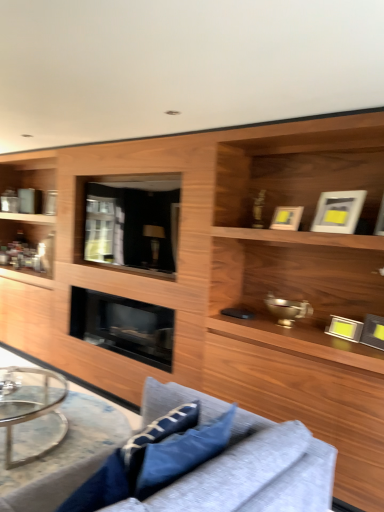
Question: Can you confirm if black glass fireplace at center is thinner than blue fabric pillow at lower center, which ranks as the first pillow in back-to-front order?

Choices:
 (A) yes
 (B) no

Answer: (B)

Question: Can you confirm if black glass fireplace at center is bigger than blue fabric pillow at lower center, acting as the second pillow starting from the left?

Choices:
 (A) yes
 (B) no

Answer: (A)

Question: From the image's perspective, is black glass fireplace at center beneath blue fabric pillow at lower center, acting as the second pillow starting from the left?

Choices:
 (A) no
 (B) yes

Answer: (A)

Question: Is black glass fireplace at center next to blue fabric pillow at lower center, which ranks as the first pillow in back-to-front order, and touching it?

Choices:
 (A) no
 (B) yes

Answer: (A)

Question: Is black glass fireplace at center far away from blue fabric pillow at lower center, the 2th pillow viewed from the front?

Choices:
 (A) no
 (B) yes

Answer: (B)

Question: Considering the positions of clear glass round table at lower left and blue fabric pillow at lower center, the 1th pillow positioned from the left, in the image, is clear glass round table at lower left bigger or smaller than blue fabric pillow at lower center, the 1th pillow positioned from the left,?

Choices:
 (A) big
 (B) small

Answer: (A)

Question: Is clear glass round table at lower left wider or thinner than blue fabric pillow at lower center, the 1th pillow positioned from the left?

Choices:
 (A) wide
 (B) thin

Answer: (A)

Question: Would you say clear glass round table at lower left is to the left or to the right of blue fabric pillow at lower center, which is the second pillow in back-to-front order, in the picture?

Choices:
 (A) left
 (B) right

Answer: (A)

Question: Is clear glass round table at lower left situated inside blue fabric pillow at lower center, positioned as the second pillow in right-to-left order, or outside?

Choices:
 (A) inside
 (B) outside

Answer: (B)

Question: From a real-world perspective, is clear glass coffee table at lower left positioned above or below transparent glass door at center?

Choices:
 (A) above
 (B) below

Answer: (B)

Question: From the image's perspective, relative to transparent glass door at center, is clear glass coffee table at lower left above or below?

Choices:
 (A) below
 (B) above

Answer: (A)

Question: Is point (26, 400) closer or farther from the camera than point (175, 189)?

Choices:
 (A) closer
 (B) farther

Answer: (B)

Question: Considering the positions of clear glass coffee table at lower left and transparent glass door at center in the image, is clear glass coffee table at lower left bigger or smaller than transparent glass door at center?

Choices:
 (A) small
 (B) big

Answer: (B)

Question: From the image's perspective, is clear glass round table at lower left positioned above or below blue fabric pillow at lower center, the 2th pillow viewed from the front?

Choices:
 (A) below
 (B) above

Answer: (A)

Question: In the image, is clear glass round table at lower left on the left side or the right side of blue fabric pillow at lower center, which ranks as the first pillow in back-to-front order?

Choices:
 (A) left
 (B) right

Answer: (A)